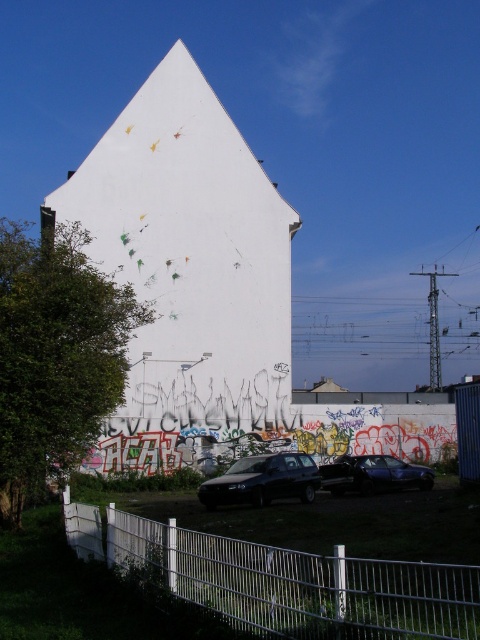
You are a pedestrian standing in front of the building and want to walk to the metallic blue sedan at center. Which direction should you move relative to the white metal fence at lower center?

Since the white metal fence at lower center is to the left of the metallic blue sedan at center, you should move to the right of the white metal fence at lower center to reach the metallic blue sedan at center.